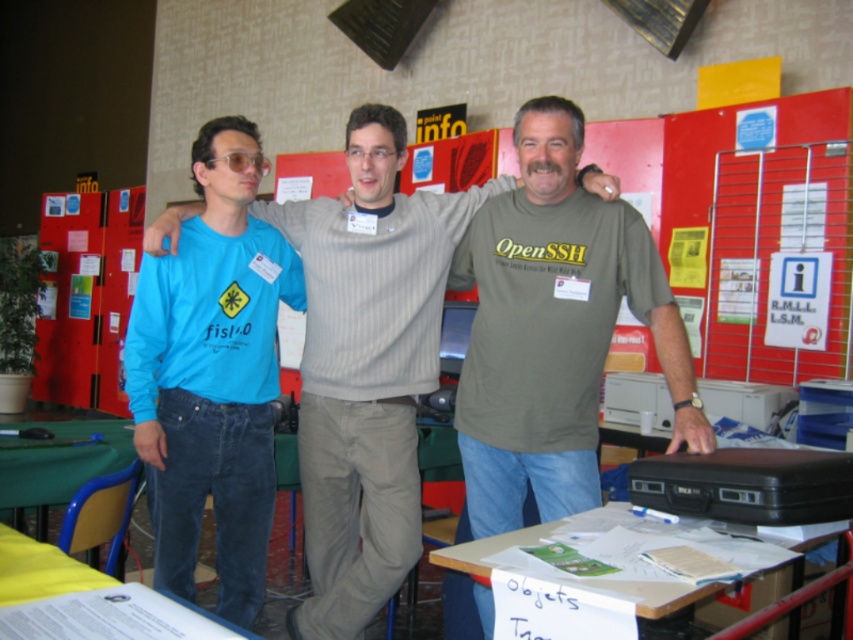
You are organizing a photo shoot and need to arrange the matte gray shirt at center and the matte blue shirt at left in a display case. The case has a height limit of 18 inches. Which shirt should you place first to ensure both fit vertically?

The matte gray shirt at center is larger than the matte blue shirt at left. To ensure both fit vertically in the display case with an 18 inch height limit, place the smaller matte blue shirt at left first, then the larger matte gray shirt at center on top.

You are standing in the room where the three people are posing for a photo. There is a green fabric table at lower left. If you want to move from your current position to the table, which direction should you move relative to the people?

The green fabric table at lower left is located at point (59,465), so you should move towards the lower left direction relative to the people to reach it.